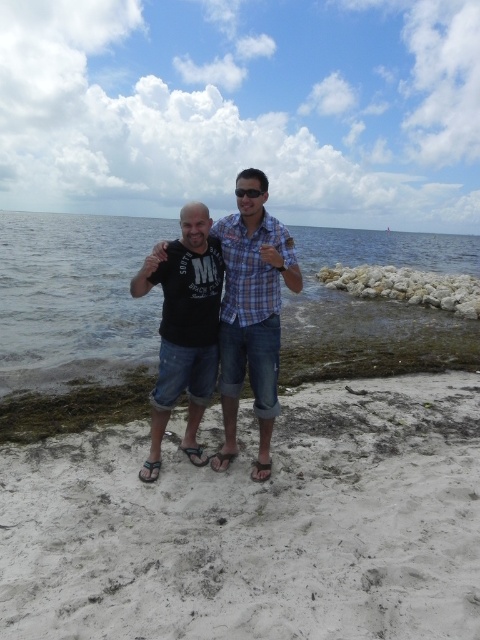
Question: Which point is closer to the camera?

Choices:
 (A) matte black shirt at center
 (B) black matte t-shirt at center

Answer: (A)

Question: In this image, where is matte black shirt at center located relative to black matte t-shirt at center?

Choices:
 (A) above
 (B) below

Answer: (A)

Question: Is clear water at lower left in front of matte black shirt at center?

Choices:
 (A) yes
 (B) no

Answer: (B)

Question: Which object appears farthest from the camera in this image?

Choices:
 (A) white sandy beach at center
 (B) black matte t-shirt at center
 (C) matte black shirt at center

Answer: (B)

Question: Is white sandy beach at center bigger than matte black shirt at center?

Choices:
 (A) yes
 (B) no

Answer: (B)

Question: Which object is closer to the camera taking this photo?

Choices:
 (A) white sandy beach at center
 (B) matte black shirt at center

Answer: (A)